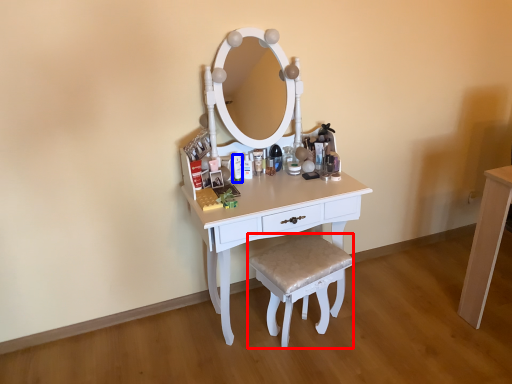
Question: Which object appears closest to the camera in this image, stool (highlighted by a red box) or toiletry (highlighted by a blue box)?

Choices:
 (A) stool
 (B) toiletry

Answer: (A)